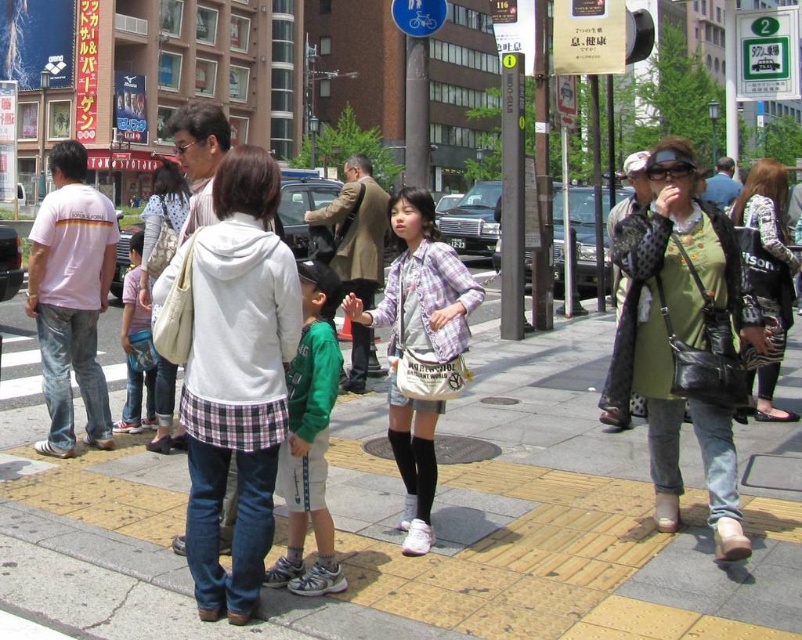
Can you confirm if white cotton t-shirt at left is taller than green cotton shirt at center?

Indeed, white cotton t-shirt at left has a greater height compared to green cotton shirt at center.

Which is above, white cotton t-shirt at left or green cotton shirt at center?

Positioned higher is white cotton t-shirt at left.

Who is more forward, (x=67, y=403) or (x=323, y=563)?

Point (x=323, y=563)

Identify the location of white cotton t-shirt at left. (71, 298).

Can you confirm if white cotton hoodie at center is positioned to the left of light pink cotton shirt at center?

Incorrect, white cotton hoodie at center is not on the left side of light pink cotton shirt at center.

Is white cotton hoodie at center positioned behind light pink cotton shirt at center?

No, white cotton hoodie at center is closer to the viewer.

Does point (209, 272) lie in front of point (134, 364)?

That is True.

Where is `white cotton hoodie at center`? white cotton hoodie at center is located at coordinates (237, 380).

Who is higher up, white cotton hoodie at center or white cotton t-shirt at left?

white cotton t-shirt at left is higher up.

How much distance is there between white cotton hoodie at center and white cotton t-shirt at left?

white cotton hoodie at center and white cotton t-shirt at left are 3.79 meters apart.

Where is `white cotton hoodie at center`? This screenshot has height=640, width=802. white cotton hoodie at center is located at coordinates [237, 380].

The image size is (802, 640). Find the location of `white cotton hoodie at center`. white cotton hoodie at center is located at coordinates (237, 380).